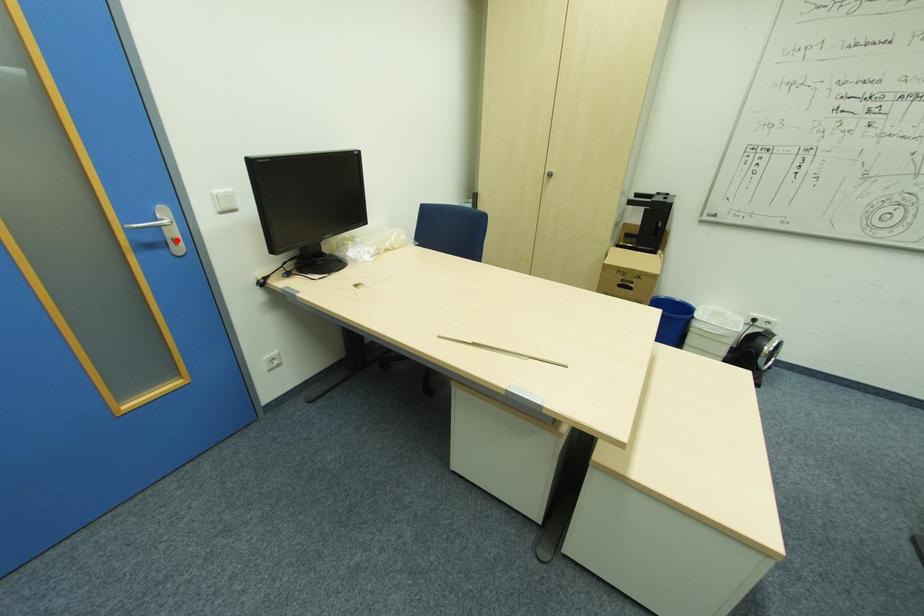
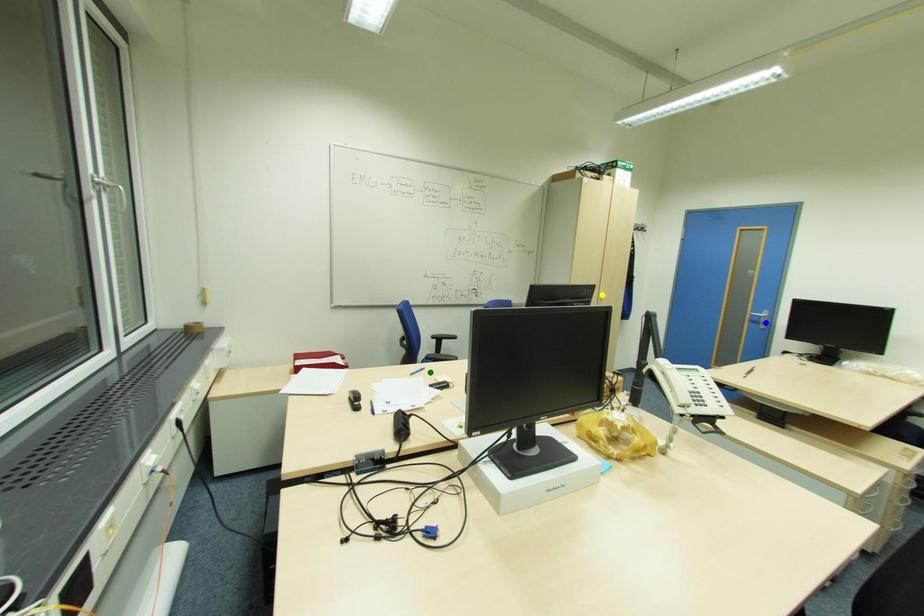
Question: I am providing you with two images of the same scene from different viewpoints. A red point is marked on the first image. You are given multiple points on the second image. Which point in image 2 represents the same 3d spot as the red point in image 1?

Choices:
 (A) yellow point
 (B) blue point
 (C) green point

Answer: (B)